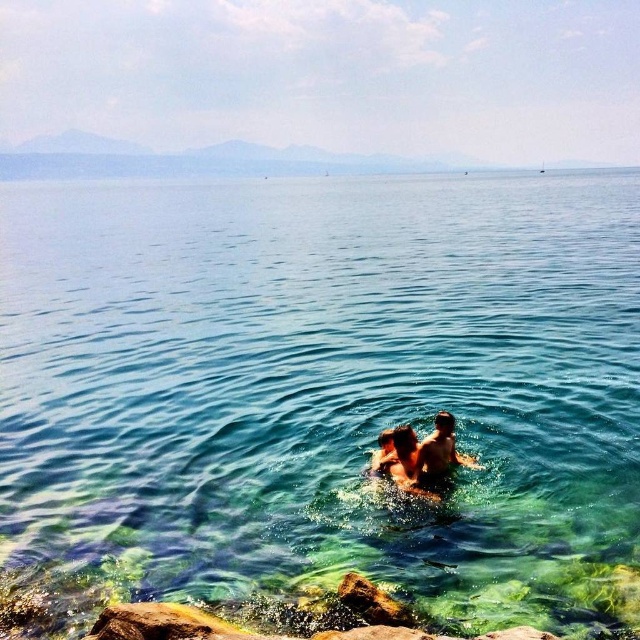
You are a swimmer who wants to avoid getting your skin wet. You see the clear water at center and the smooth skin man at center in the coastal scene. Which object can you touch without getting wet?

The smooth skin man at center can be touched without getting wet because the clear water at center is positioned over him, meaning he is under the water.

You are a photographer standing on the rocky shoreline. You want to take a photo of the clear water at center and the smooth skin man at center. Which object will appear larger in the photo?

The clear water at center will appear larger in the photo because it is closer to the viewer than the smooth skin man at center.

You are a photographer trying to capture the smooth skin couple at center in a coastal scene. Based on their coordinates, where exactly should you position your camera to ensure they are centered in the frame?

The smooth skin couple at center is located at coordinates point (420, 456), so to center them in the frame, position your camera directly facing that coordinate point.